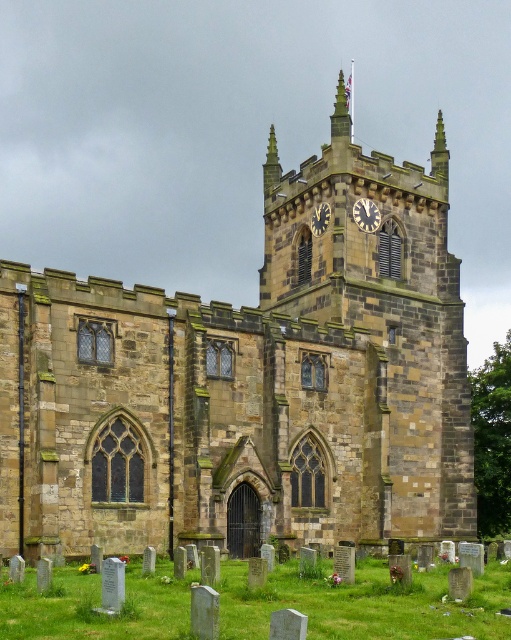
Who is taller, brown stone clock tower at center or metallic clock face at upper center?

Standing taller between the two is brown stone clock tower at center.

Is point (328, 288) more distant than point (359, 200)?

No.

The width and height of the screenshot is (511, 640). Identify the location of brown stone clock tower at center. (370, 340).

Does brown stone clock tower at center lie behind gold textured clock at upper center?

No, it is in front of gold textured clock at upper center.

This screenshot has height=640, width=511. In order to click on brown stone clock tower at center in this screenshot , I will do `click(370, 340)`.

From the picture: Is metallic clock face at upper center to the left of gold textured clock at upper center from the viewer's perspective?

No, metallic clock face at upper center is not to the left of gold textured clock at upper center.

Which is more to the right, metallic clock face at upper center or gold textured clock at upper center?

From the viewer's perspective, metallic clock face at upper center appears more on the right side.

Identify the location of metallic clock face at upper center. The image size is (511, 640). (365, 214).